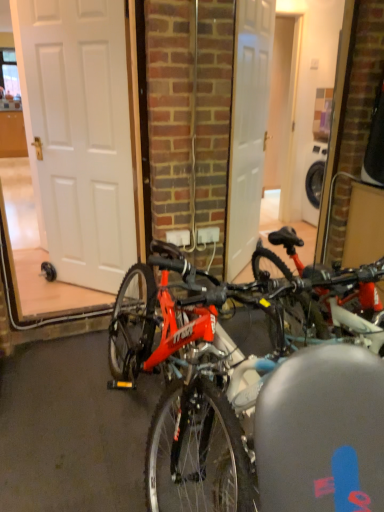
Describe the element at coordinates (257, 388) in the screenshot. The image size is (384, 512). I see `shiny red bicycle at center` at that location.

I want to click on shiny red bicycle at center, so [x=257, y=388].

Describe the element at coordinates (79, 135) in the screenshot. I see `white matte door at left` at that location.

Locate an element on the screen. Image resolution: width=384 pixels, height=512 pixels. white matte door at left is located at coordinates (79, 135).

At what (x,y) coordinates should I click in order to perform the action: click on shiny red bicycle at center. Please return your answer as a coordinate pair (x, y). Looking at the image, I should click on (257, 388).

Is white matte door at left at the left side of shiny red bicycle at center?

Yes.

From the picture: Who is more distant, white matte door at left or shiny red bicycle at center?

white matte door at left is further from the camera.

Considering the points (131, 188) and (366, 470), which point is in front, point (131, 188) or point (366, 470)?

The point (366, 470) is closer to the camera.

From the image's perspective, is white matte door at left located above shiny red bicycle at center?

Yes, from the image's perspective, white matte door at left is on top of shiny red bicycle at center.

From a real-world perspective, is white matte door at left located higher than shiny red bicycle at center?

Correct, in the physical world, white matte door at left is higher than shiny red bicycle at center.

Considering the relative sizes of white matte door at left and shiny red bicycle at center in the image provided, is white matte door at left wider than shiny red bicycle at center?

Incorrect, the width of white matte door at left does not surpass that of shiny red bicycle at center.

Between white matte door at left and shiny red bicycle at center, which one has more height?

white matte door at left is taller.

Based on their sizes in the image, would you say white matte door at left is bigger or smaller than shiny red bicycle at center?

In the image, white matte door at left appears to be smaller than shiny red bicycle at center.

Is white matte door at left completely or partially outside of shiny red bicycle at center?

Yes, white matte door at left is located beyond the bounds of shiny red bicycle at center.

Are white matte door at left and shiny red bicycle at center far apart?

Yes, white matte door at left and shiny red bicycle at center are located far from each other.

Is white matte door at left positioned with its back to shiny red bicycle at center?

That's not correct — white matte door at left is not looking away from shiny red bicycle at center.

How far apart are white matte door at left and shiny red bicycle at center?

They are 3.51 feet apart.

Where is `door located above the shiny red bicycle at center (from a real-world perspective)`? This screenshot has height=512, width=384. door located above the shiny red bicycle at center (from a real-world perspective) is located at coordinates (79, 135).

Would you say shiny red bicycle at center is to the left or to the right of white matte door at left in the picture?

Clearly, shiny red bicycle at center is on the right of white matte door at left in the image.

Looking at this image, which is behind, shiny red bicycle at center or white matte door at left?

white matte door at left is more distant.

Is point (176, 483) farther from camera compared to point (49, 138)?

No, (176, 483) is in front of (49, 138).

In the scene shown: From the image's perspective, which object appears higher, shiny red bicycle at center or white matte door at left?

white matte door at left, from the image's perspective.

From a real-world perspective, is shiny red bicycle at center above or below white matte door at left?

In terms of real-world spatial position, shiny red bicycle at center is below white matte door at left.

Does shiny red bicycle at center have a lesser width compared to white matte door at left?

No.

Does shiny red bicycle at center have a lesser height compared to white matte door at left?

Yes, shiny red bicycle at center is shorter than white matte door at left.

Which of these two, shiny red bicycle at center or white matte door at left, is smaller?

Smaller between the two is white matte door at left.

Is shiny red bicycle at center inside or outside of white matte door at left?

shiny red bicycle at center cannot be found inside white matte door at left.

Are shiny red bicycle at center and white matte door at left located far from each other?

Indeed, shiny red bicycle at center is not near white matte door at left.

Could you tell me if shiny red bicycle at center is facing white matte door at left?

No, shiny red bicycle at center is not turned towards white matte door at left.

How different are the orientations of shiny red bicycle at center and white matte door at left in degrees?

The angular difference between shiny red bicycle at center and white matte door at left is 46.5 degrees.

How much distance is there between shiny red bicycle at center and white matte door at left?

shiny red bicycle at center and white matte door at left are 3.51 feet apart.

Where is `bicycle to the right of white matte door at left`? This screenshot has height=512, width=384. bicycle to the right of white matte door at left is located at coordinates (257, 388).

Find the location of `bicycle on the right of white matte door at left`. bicycle on the right of white matte door at left is located at coordinates (257, 388).

Where is `door above the shiny red bicycle at center (from the image's perspective)`? door above the shiny red bicycle at center (from the image's perspective) is located at coordinates (79, 135).